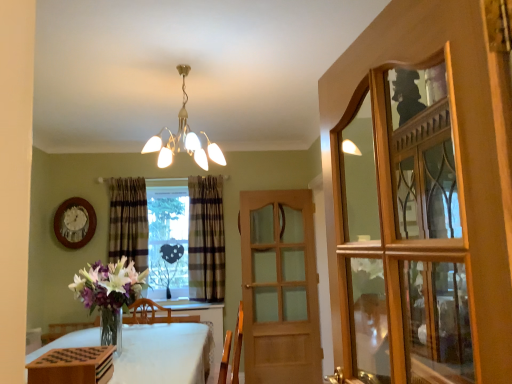
Question: Considering the relative sizes of wooden glass cabinet at right and white cloth-covered table at lower left in the image provided, is wooden glass cabinet at right bigger than white cloth-covered table at lower left?

Choices:
 (A) yes
 (B) no

Answer: (B)

Question: Is wooden glass cabinet at right positioned beyond the bounds of white cloth-covered table at lower left?

Choices:
 (A) yes
 (B) no

Answer: (A)

Question: Is wooden glass cabinet at right looking in the opposite direction of white cloth-covered table at lower left?

Choices:
 (A) no
 (B) yes

Answer: (A)

Question: Could you tell me if wooden glass cabinet at right is facing white cloth-covered table at lower left?

Choices:
 (A) no
 (B) yes

Answer: (A)

Question: Can you confirm if wooden glass cabinet at right is taller than white cloth-covered table at lower left?

Choices:
 (A) no
 (B) yes

Answer: (B)

Question: Considering the positions of light brown wooden door at center and plaid fabric curtain at center, which is the 1th curtain in left-to-right order, in the image, is light brown wooden door at center taller or shorter than plaid fabric curtain at center, which is the 1th curtain in left-to-right order,?

Choices:
 (A) tall
 (B) short

Answer: (A)

Question: Considering their positions, is light brown wooden door at center located in front of or behind plaid fabric curtain at center, which is the 1th curtain in left-to-right order?

Choices:
 (A) front
 (B) behind

Answer: (A)

Question: Considering the relative positions of light brown wooden door at center and plaid fabric curtain at center, which appears as the 2th curtain when viewed from the right, in the image provided, is light brown wooden door at center to the left or to the right of plaid fabric curtain at center, which appears as the 2th curtain when viewed from the right,?

Choices:
 (A) left
 (B) right

Answer: (B)

Question: Is light brown wooden door at center situated inside plaid fabric curtain at center, which is the 1th curtain in left-to-right order, or outside?

Choices:
 (A) inside
 (B) outside

Answer: (B)

Question: Relative to plaid fabric curtain at center, which is the 1th curtain in left-to-right order, is metallic chandelier at upper center in front or behind?

Choices:
 (A) behind
 (B) front

Answer: (B)

Question: Considering the positions of metallic chandelier at upper center and plaid fabric curtain at center, which is the 1th curtain in left-to-right order, in the image, is metallic chandelier at upper center wider or thinner than plaid fabric curtain at center, which is the 1th curtain in left-to-right order,?

Choices:
 (A) wide
 (B) thin

Answer: (A)

Question: Looking at the image, does metallic chandelier at upper center seem bigger or smaller compared to plaid fabric curtain at center, which is the 1th curtain in left-to-right order?

Choices:
 (A) big
 (B) small

Answer: (A)

Question: Which is correct: metallic chandelier at upper center is inside plaid fabric curtain at center, which appears as the 2th curtain when viewed from the right, or outside of it?

Choices:
 (A) outside
 (B) inside

Answer: (A)

Question: Is plaid fabric curtain at center, which is the 1th curtain in left-to-right order, spatially inside white cloth-covered table at lower left, or outside of it?

Choices:
 (A) outside
 (B) inside

Answer: (A)

Question: In the image, is plaid fabric curtain at center, which is the 1th curtain in left-to-right order, on the left side or the right side of white cloth-covered table at lower left?

Choices:
 (A) left
 (B) right

Answer: (A)